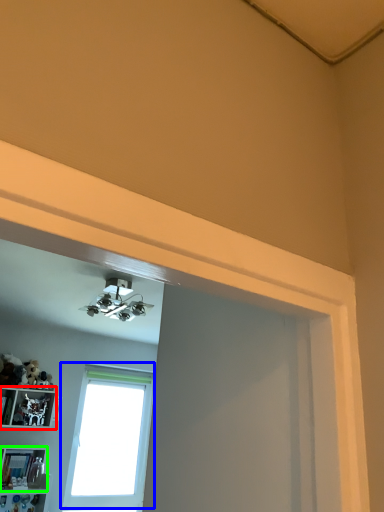
Question: Estimate the real-world distances between objects in this image. Which object is farther from shelf (highlighted by a red box), window (highlighted by a blue box) or shelf (highlighted by a green box)?

Choices:
 (A) window
 (B) shelf

Answer: (A)